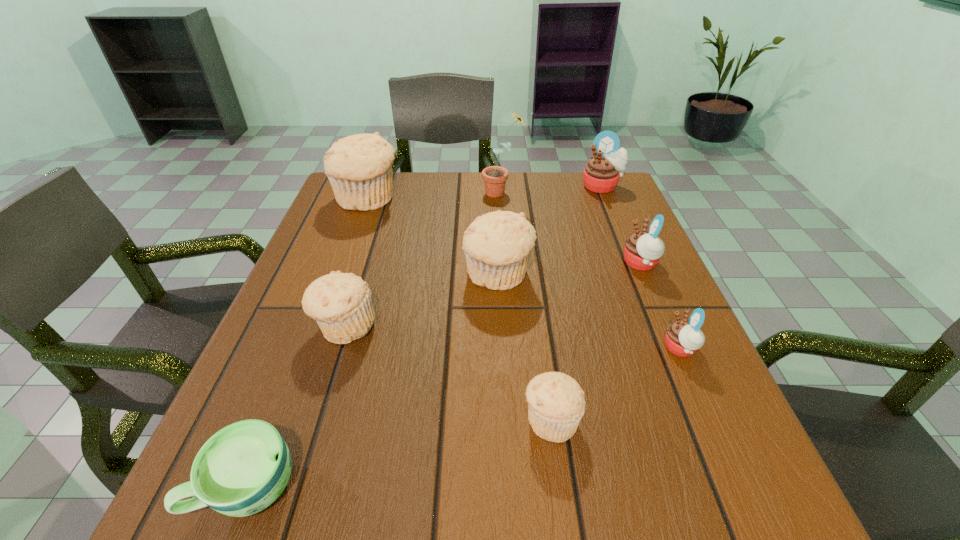
Locate an element on the screen. the tallest object is located at coordinates (494, 177).

At what (x,y) coordinates should I click in order to perform the action: click on the farthest beige muffin. Please return your answer as a coordinate pair (x, y). Looking at the image, I should click on [359, 167].

At what (x,y) coordinates should I click in order to perform the action: click on the biggest pink muffin. Please return your answer as a coordinate pair (x, y). The image size is (960, 540). Looking at the image, I should click on (602, 172).

This screenshot has width=960, height=540. Find the location of `the second farthest beige muffin`. the second farthest beige muffin is located at coordinates (497, 245).

Find the location of a particular element. This screenshot has height=540, width=960. the second nearest pink muffin is located at coordinates (642, 251).

The image size is (960, 540). In order to click on the second nearest beige muffin in this screenshot , I will do `click(341, 304)`.

You are a GUI agent. You are given a task and a screenshot of the screen. Output one action in this format:
    pyautogui.click(x=<x>, y=<y>)
    Task: Click on the smallest pink muffin
    
    Given the screenshot: What is the action you would take?
    pyautogui.click(x=683, y=338)

Where is `the nearest beige muffin`? the nearest beige muffin is located at coordinates (556, 403).

This screenshot has width=960, height=540. Identify the location of the nearest muffin. (556, 403).

The height and width of the screenshot is (540, 960). I want to click on blue cup, so click(x=243, y=468).